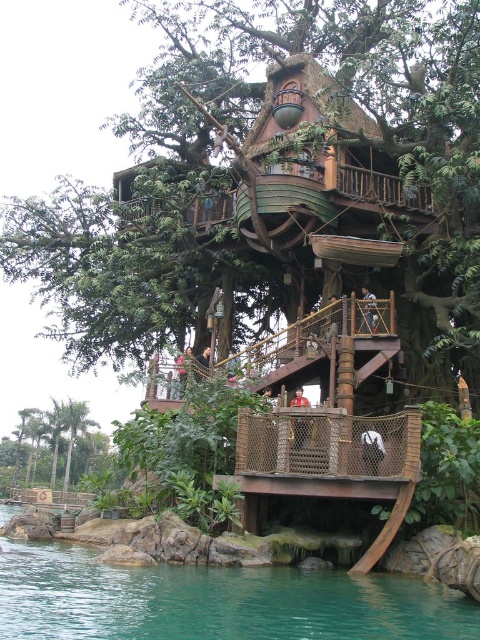
Between point (43, 572) and point (2, 452), which one is positioned behind?

Point (2, 452)

Which is behind, point (68, 608) or point (48, 451)?

Positioned behind is point (48, 451).

This screenshot has height=640, width=480. What are the coordinates of `teal glossy water at lower center` in the screenshot? It's located at (215, 602).